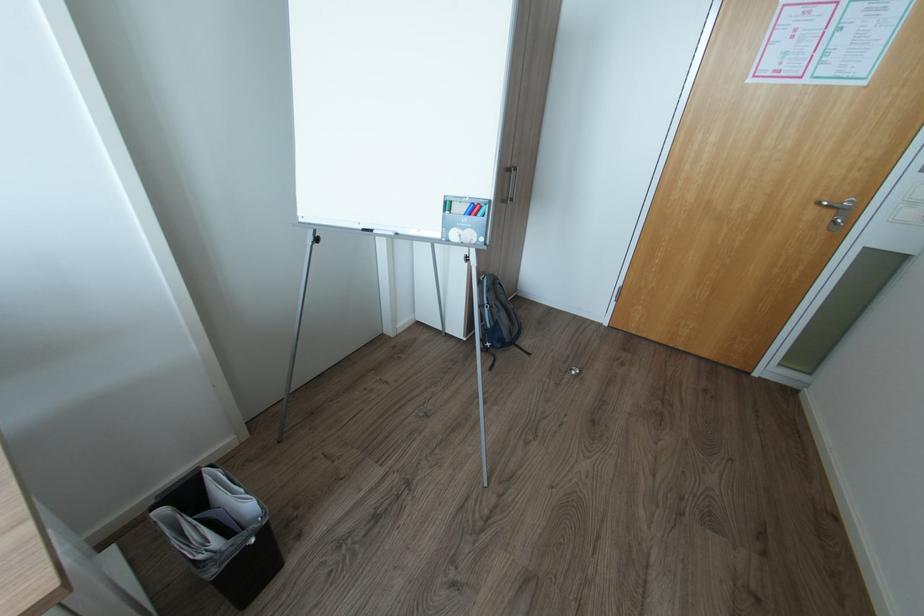
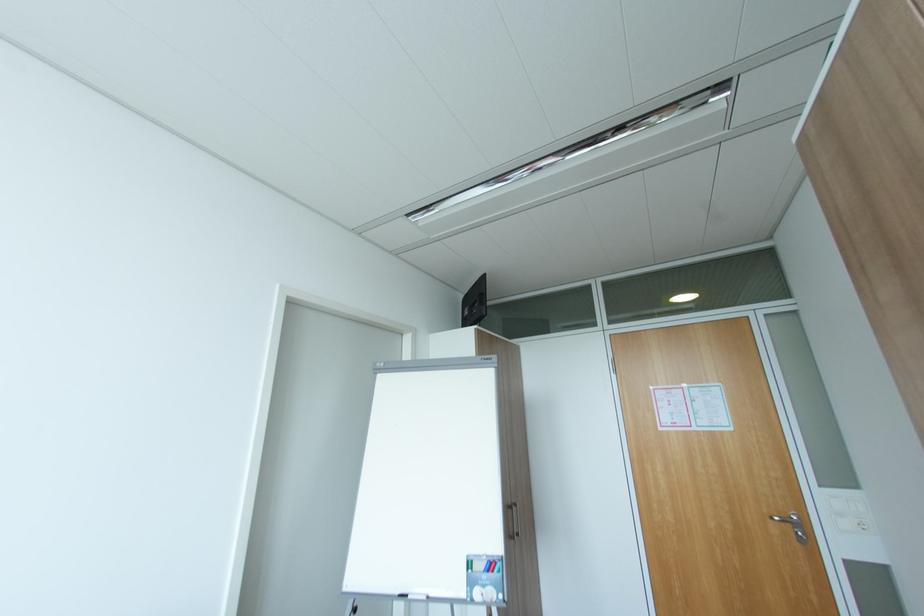
Question: How did the camera likely rotate?

Choices:
 (A) Left
 (B) Right
 (C) Up
 (D) Down

Answer: (C)